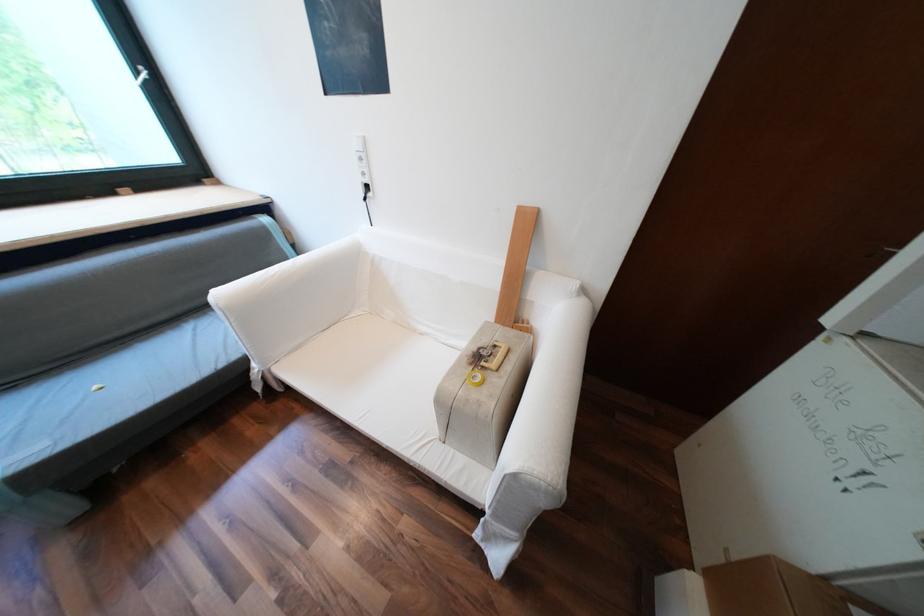
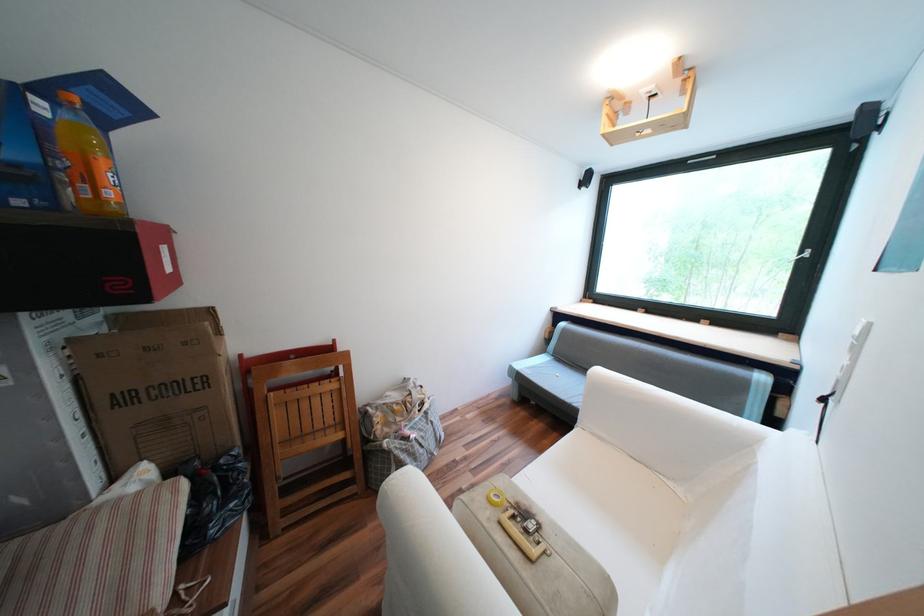
The point at [146,71] is marked in the first image. Where is the corresponding point in the second image?

(809, 253)